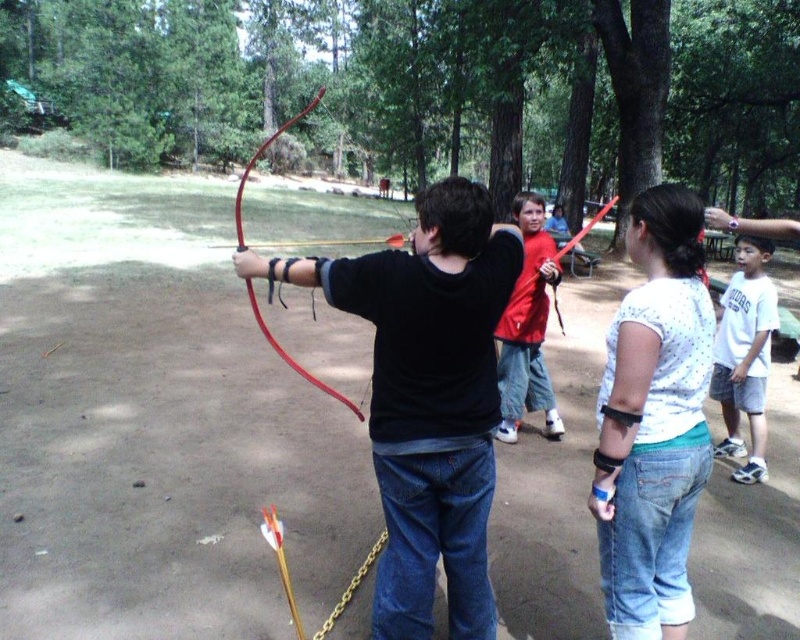
Question: Estimate the real-world distances between objects in this image. Which object is farther from the matte black bow at center?

Choices:
 (A) white cotton shirt at lower right
 (B) red cotton shirt at center

Answer: (A)

Question: Which object is positioned closest to the white cotton shirt at lower right?

Choices:
 (A) rubber red bow at center
 (B) matte black bow at center

Answer: (B)

Question: Does red cotton shirt at center have a greater width compared to rubber red bow at center?

Choices:
 (A) no
 (B) yes

Answer: (A)

Question: Is matte black bow at center behind rubber red bow at center?

Choices:
 (A) yes
 (B) no

Answer: (B)

Question: Does matte black bow at center have a lesser width compared to rubber red bow at center?

Choices:
 (A) yes
 (B) no

Answer: (A)

Question: Among these points, which one is nearest to the camera?

Choices:
 (A) (530, 378)
 (B) (766, 305)
 (C) (252, 289)
 (D) (454, 579)

Answer: (D)